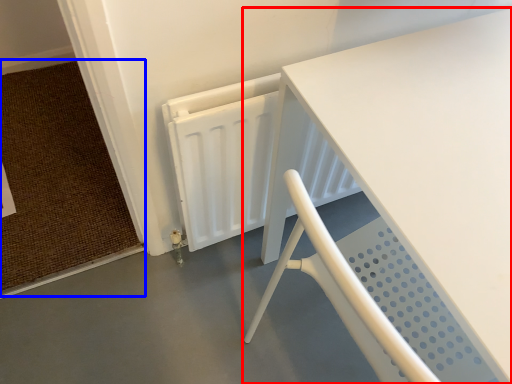
Question: Which object appears closest to the camera in this image, table (highlighted by a red box) or doormat (highlighted by a blue box)?

Choices:
 (A) table
 (B) doormat

Answer: (A)